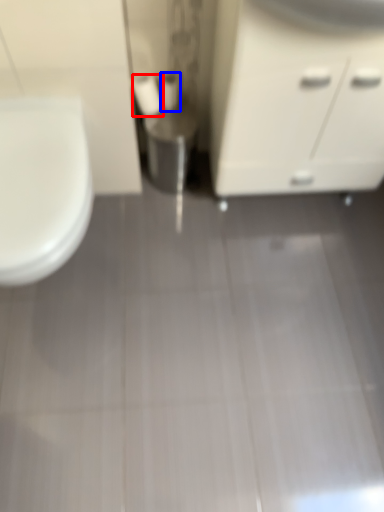
Question: Which point is further to the camera, toilet paper (highlighted by a red box) or toilet paper (highlighted by a blue box)?

Choices:
 (A) toilet paper
 (B) toilet paper

Answer: (B)